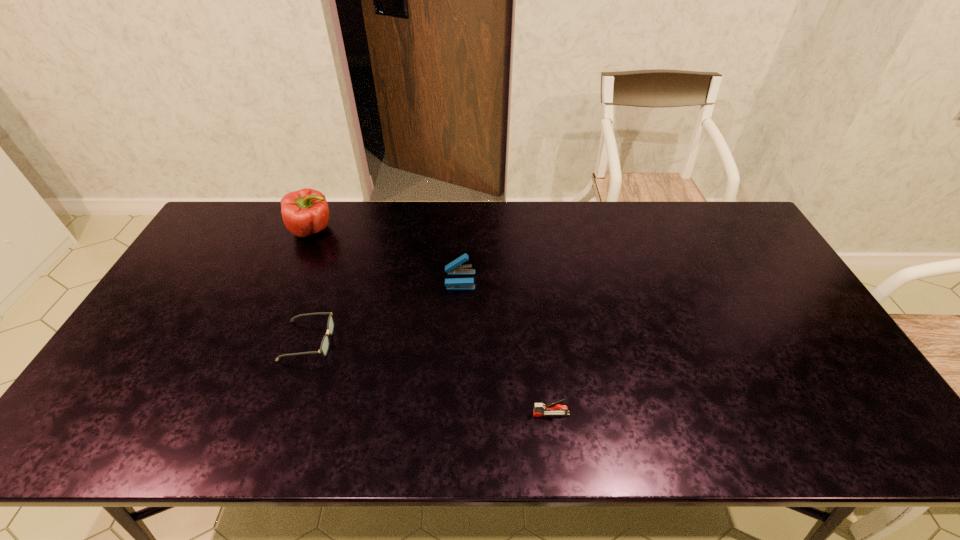
Locate an element on the screen. This screenshot has width=960, height=540. vacant area at the far right corner of the desktop is located at coordinates [697, 206].

Identify the location of empty location between the left stapler and the shortest object. Image resolution: width=960 pixels, height=540 pixels. (384, 310).

Find the location of a particular element. This screenshot has height=540, width=960. free space between the farthest object and the spectacles is located at coordinates (310, 285).

The image size is (960, 540). Identify the location of unoccupied position between the shortest object and the second object from right to left. (384, 310).

You are a GUI agent. You are given a task and a screenshot of the screen. Output one action in this format:
    pyautogui.click(x=<x>, y=<y>)
    Task: Click on the unoccupied position between the rightmost object and the farther stapler
    This screenshot has width=960, height=540.
    Given the screenshot: What is the action you would take?
    pyautogui.click(x=506, y=347)

Find the location of a particular element. The width and height of the screenshot is (960, 540). unoccupied position between the shortest object and the farther stapler is located at coordinates (384, 310).

Find the location of a particular element. Image resolution: width=960 pixels, height=540 pixels. free point between the nearer stapler and the bell pepper is located at coordinates (432, 322).

What are the coordinates of `free spot between the tallest object and the rightmost object` in the screenshot? It's located at (432, 322).

Where is `vacant space in between the nearest object and the left stapler`? The image size is (960, 540). vacant space in between the nearest object and the left stapler is located at coordinates (506, 347).

Image resolution: width=960 pixels, height=540 pixels. I want to click on free spot between the shortest object and the farthest object, so click(310, 285).